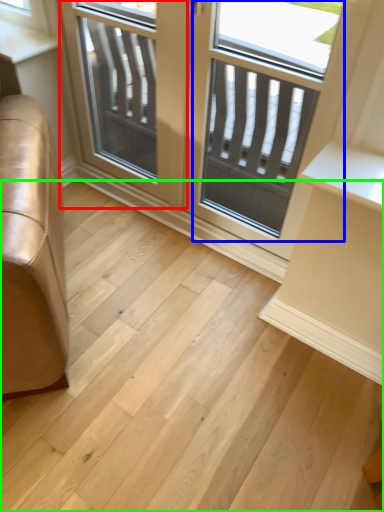
Question: Estimate the real-world distances between objects in this image. Which object is farther from screen door (highlighted by a red box), screen door (highlighted by a blue box) or stairwell (highlighted by a green box)?

Choices:
 (A) screen door
 (B) stairwell

Answer: (B)